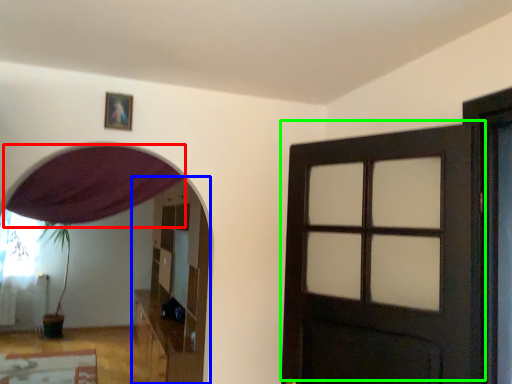
Question: Which is farther away from curtain (highlighted by a red box)? dresser (highlighted by a blue box) or door (highlighted by a green box)?

Choices:
 (A) dresser
 (B) door

Answer: (A)